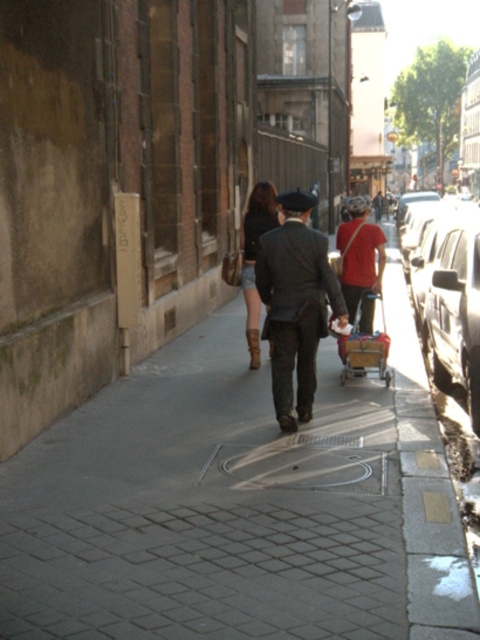
You are a photographer standing on the sidewalk in the urban street scene. You notice a matte red shirt at center and a metallic silver shopping cart at center. Which object should you adjust your camera focus to capture first if you want to photograph both in the same frame without moving your position?

The matte red shirt at center is taller than the metallic silver shopping cart at center, so you should focus on the matte red shirt at center first to ensure it is in the foreground and properly framed before adjusting for the shopping cart.

In the scene shown: You are a pedestrian standing on the sidewalk in the urban street scene. You notice a matte red shirt at center and a metallic silver shopping cart at center. Which object is positioned to the right when looking towards the direction of the shirt and cart?

The matte red shirt at center is to the right of the metallic silver shopping cart at center.

You are standing at the corner of the street and see the point marked at coordinates [296,304]. What object is located at that point?

The point at coordinates [296,304] marks the location of the matte black coat at center.